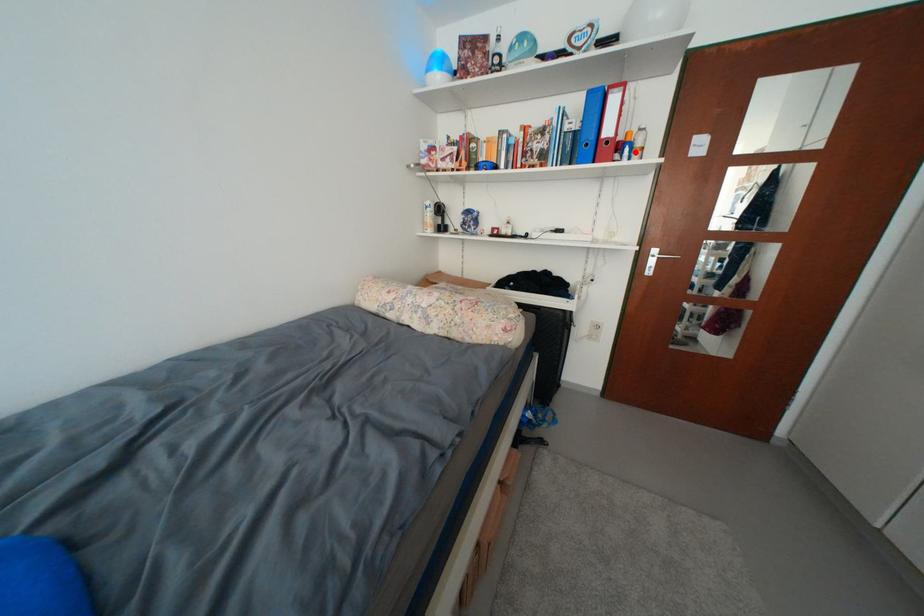
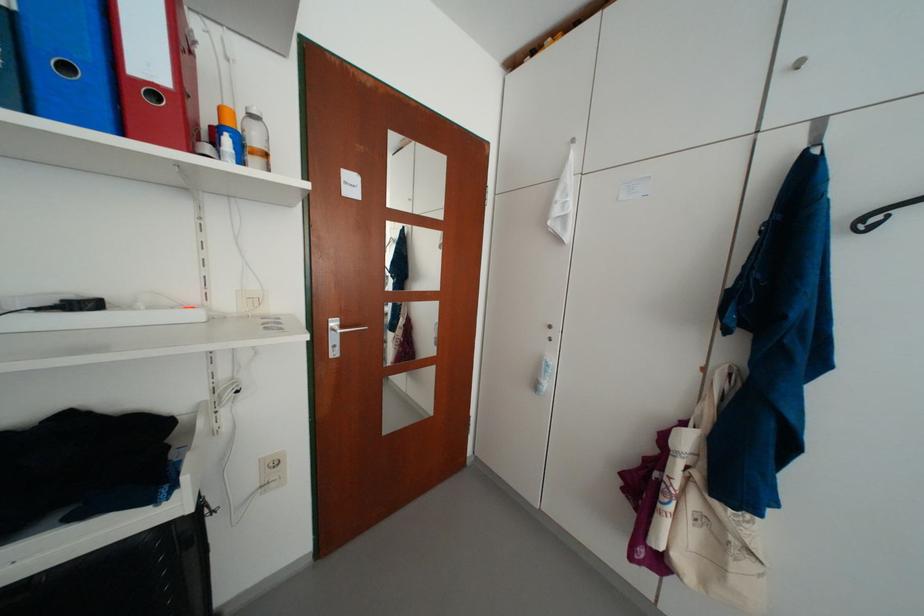
In the second image, find the point that corresponds to the highlighted location in the first image.

(236, 143)